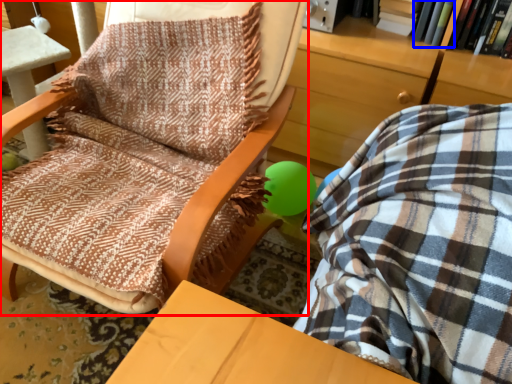
Question: Among these objects, which one is farthest to the camera, chair (highlighted by a red box) or book (highlighted by a blue box)?

Choices:
 (A) chair
 (B) book

Answer: (B)